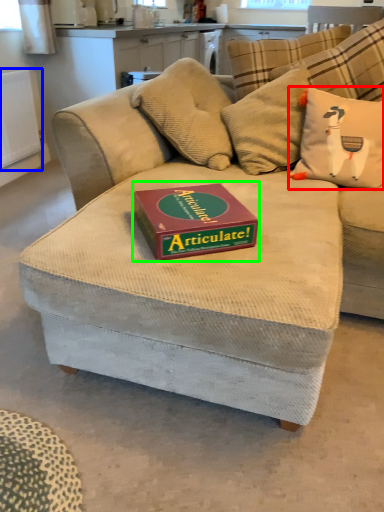
Question: Considering the real-world distances, which object is closest to throw pillow (highlighted by a red box)? radiator (highlighted by a blue box) or paperback book (highlighted by a green box).

Choices:
 (A) radiator
 (B) paperback book

Answer: (B)